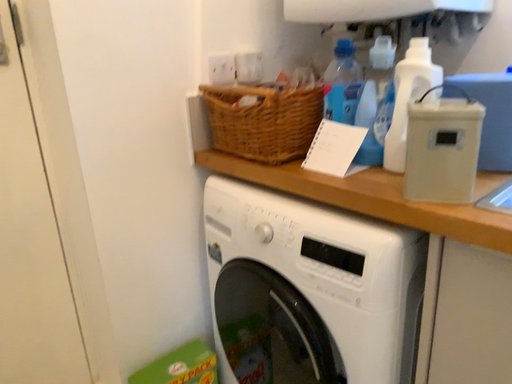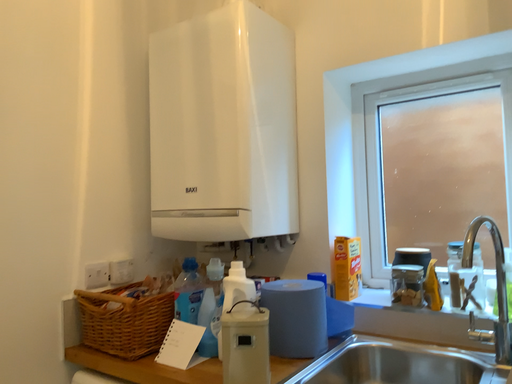
Question: How did the camera likely rotate when shooting the video?

Choices:
 (A) rotated right
 (B) rotated left

Answer: (A)